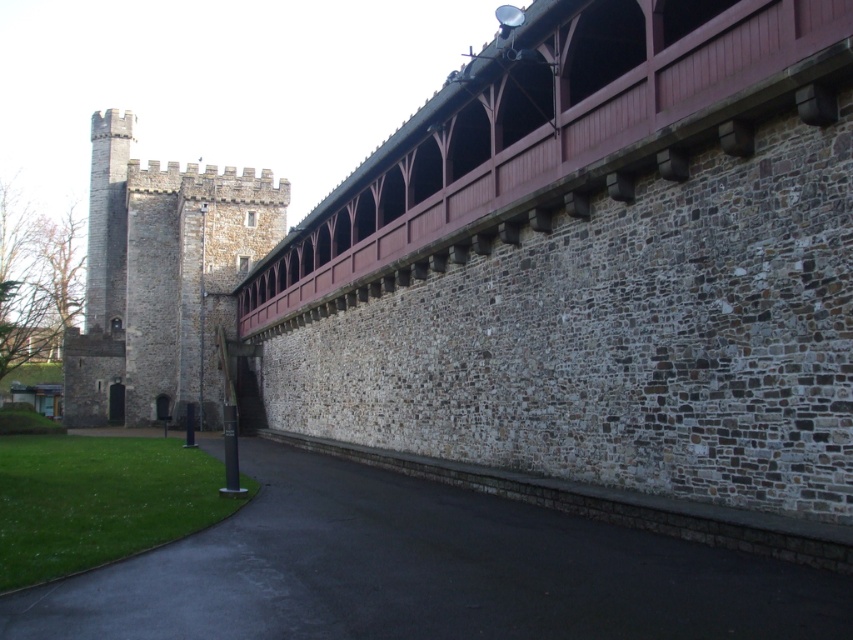
Question: Which point is farther to the camera?

Choices:
 (A) black asphalt path at lower center
 (B) gray stone tower at left
 (C) wooden planks at upper center

Answer: (B)

Question: Which of the following is the farthest from the observer?

Choices:
 (A) (97, 230)
 (B) (691, 99)
 (C) (125, 598)

Answer: (A)

Question: Is black asphalt path at lower center bigger than gray stone tower at left?

Choices:
 (A) no
 (B) yes

Answer: (A)

Question: Is black asphalt path at lower center below wooden planks at upper center?

Choices:
 (A) yes
 (B) no

Answer: (A)

Question: Is black asphalt path at lower center further to camera compared to gray stone tower at left?

Choices:
 (A) no
 (B) yes

Answer: (A)

Question: Estimate the real-world distances between objects in this image. Which object is farther from the wooden planks at upper center?

Choices:
 (A) gray stone tower at left
 (B) black asphalt path at lower center

Answer: (A)